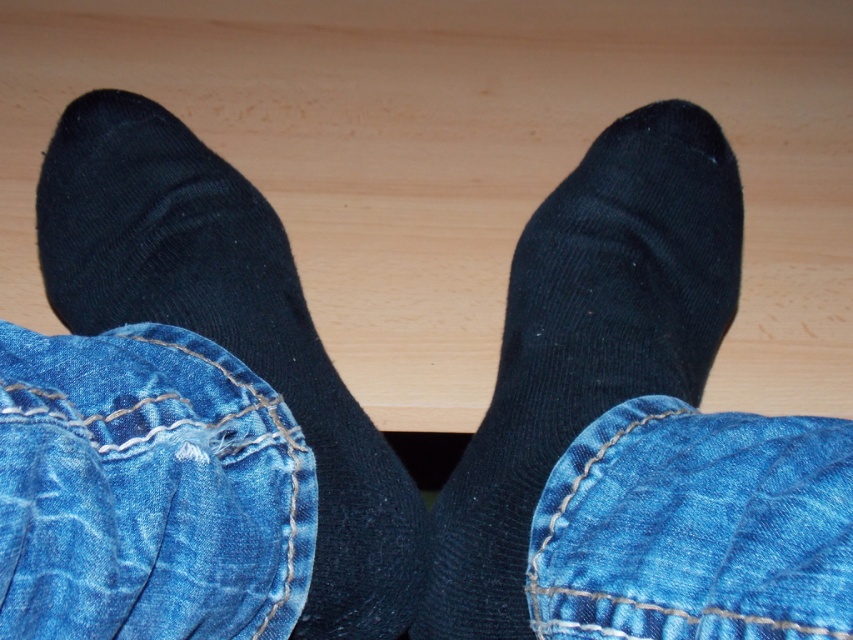
Based on the photo, who is more forward, (239,317) or (733,547)?

Positioned in front is point (733,547).

Between black cotton sock at center and denim/jeans at lower right, which one has less height?

Standing shorter between the two is denim/jeans at lower right.

Where is `black cotton sock at center`? black cotton sock at center is located at coordinates (x=227, y=326).

Locate an element on the screen. denim/jeans at lower left is located at coordinates (148, 490).

Between denim/jeans at lower left and denim/jeans at lower right, which one is positioned lower?

denim/jeans at lower right is lower down.

The image size is (853, 640). What do you see at coordinates (148, 490) in the screenshot?
I see `denim/jeans at lower left` at bounding box center [148, 490].

What are the coordinates of `denim/jeans at lower left` in the screenshot? It's located at (148, 490).

Between denim/jeans at lower left and black cotton sock at center, which one is positioned higher?

black cotton sock at center is higher up.

At what (x,y) coordinates should I click in order to perform the action: click on denim/jeans at lower left. Please return your answer as a coordinate pair (x, y). The height and width of the screenshot is (640, 853). Looking at the image, I should click on (148, 490).

Locate an element on the screen. denim/jeans at lower left is located at coordinates pyautogui.click(x=148, y=490).